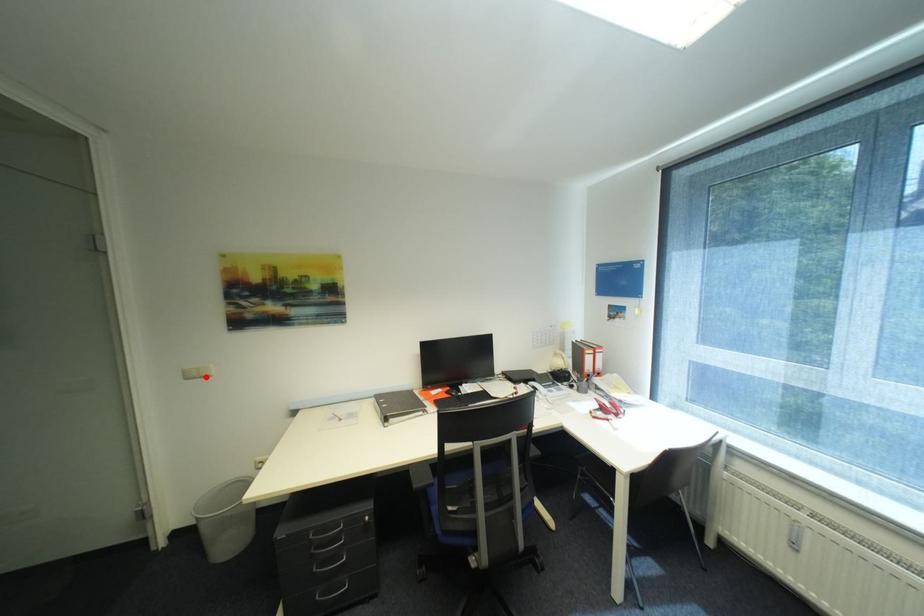
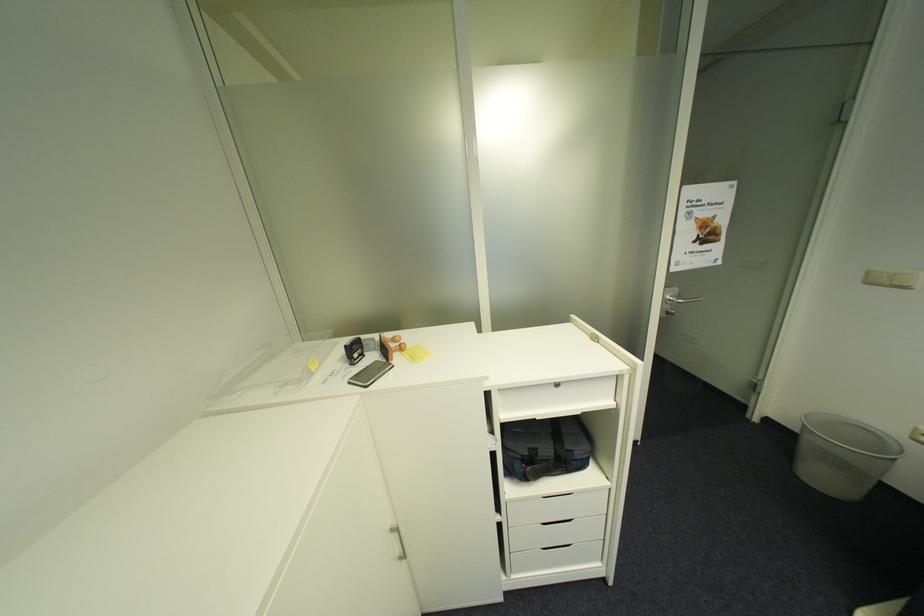
Question: I am providing you with two images of the same scene from different viewpoints. A red point is shown in image1. For the corresponding object point in image2, is it positioned nearer or farther from the camera?

Choices:
 (A) Nearer
 (B) Farther

Answer: (B)